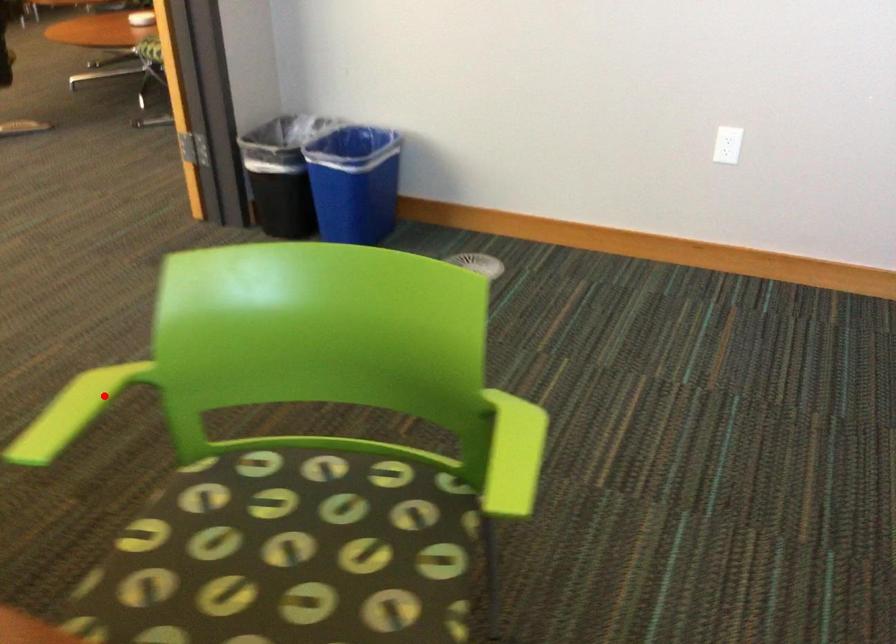
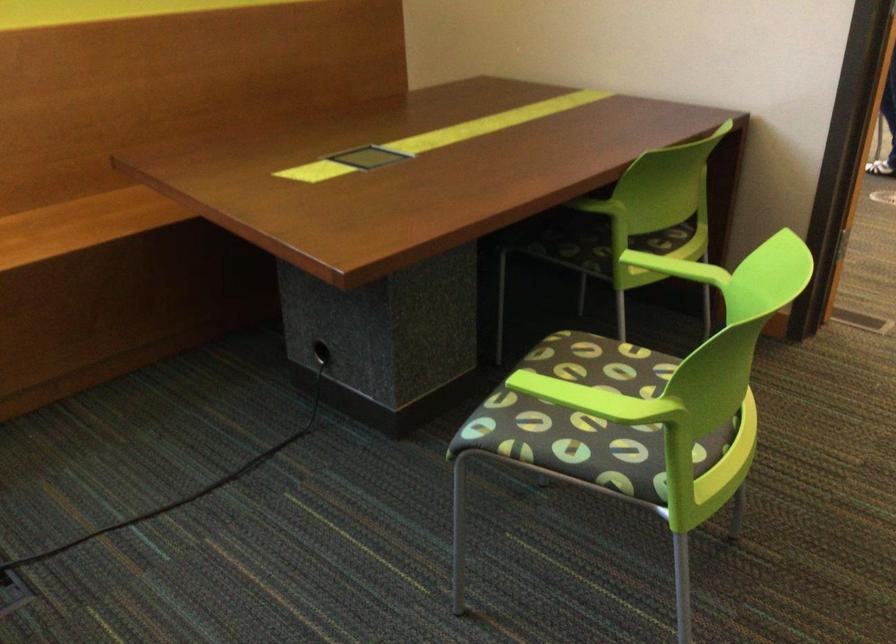
Question: I am providing you with two images of the same scene from different viewpoints. A red point is shown in image1. For the corresponding object point in image2, is it positioned nearer or farther from the camera?

Choices:
 (A) Nearer
 (B) Farther

Answer: (B)